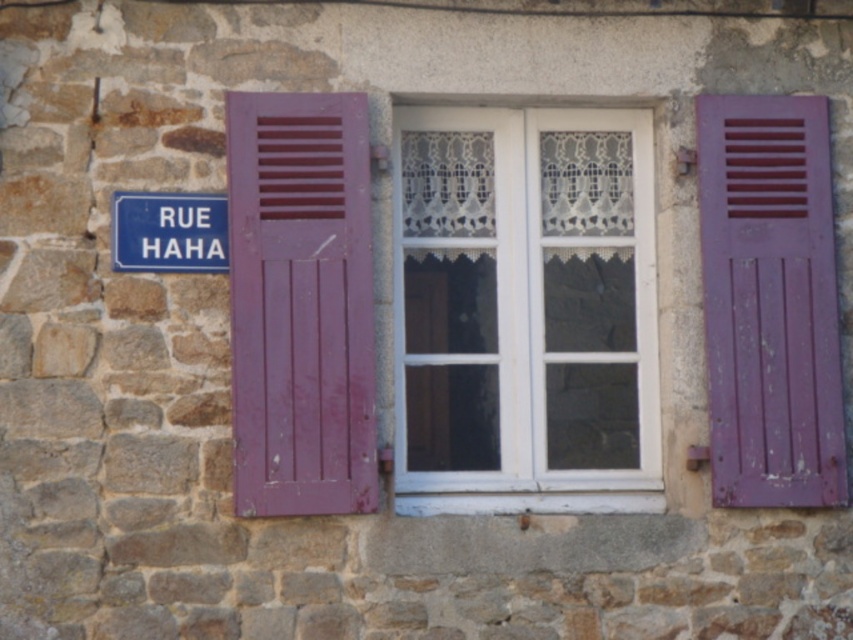
You are an architect assessing the stone wall with its window and shutters. You need to determine if the purple matte shutter at left obscures the blue plastic sign at upper left from the outside. Based on the scene description, what is your conclusion?

The purple matte shutter at left is in front of the blue plastic sign at upper left, so it does block the view of the sign from the outside.

You are standing in front of the stone wall with the window. There is a point marked at coordinates (770,301). What object is located at this point?

The point at coordinates (770,301) is occupied by the purple matte shutter at right.

You are standing in front of a stone wall with a window. There are two points marked on the wall at coordinates point (245, 188) and point (202, 216). From your perspective, which point is closer to you?

Point (245, 188) is in front of point (202, 216), so it is closer to you.